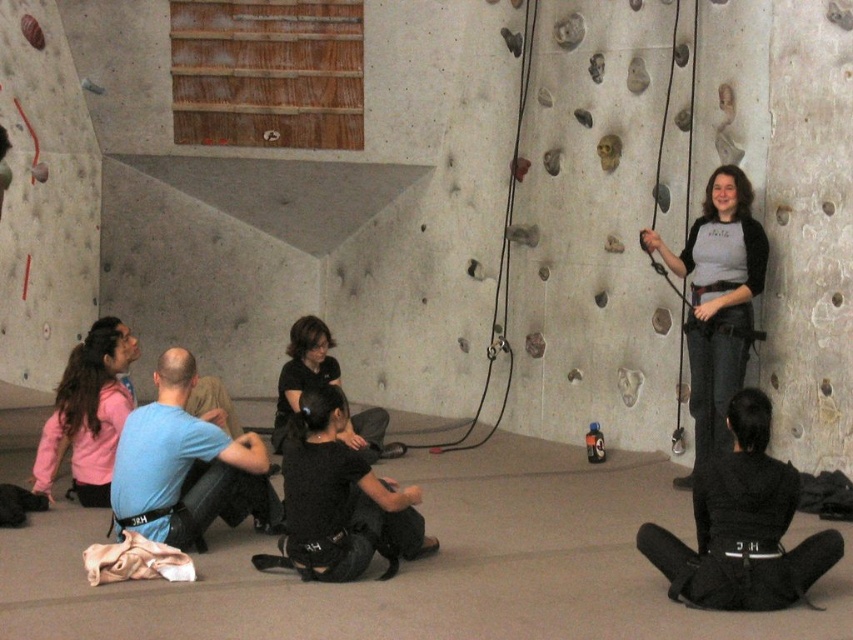
Looking at this image, you are a participant in the climbing lesson and need to retrieve both the black fabric squat at lower right and the black matte squat at center. Which one is closer to your current position if you are standing at the bottom of the climbing wall?

The black fabric squat at lower right is closer to your current position because it is located below the black matte squat at center, meaning it is nearer to the bottom of the climbing wall where you are standing.

You are a participant in the climbing lesson and need to retrieve your belongings stored near the black fabric squat at lower right. However, you are currently standing next to the black matte shirt at center. Which direction should you move to reach the squat?

A: Since the black fabric squat at lower right is closer to the viewer than the black matte shirt at center, you should move forward towards the black fabric squat at lower right to retrieve your belongings.

You are a photographer standing in the center of the room. You need to take a photo of the black fabric squat at lower right and the black matte shirt at center so that both are in the frame. Given that your camera has a maximum focal length that allows capturing objects within a 12 feet range, will you be able to include both in the same photo?

The black fabric squat at lower right and black matte shirt at center are 11.54 feet apart from each other. Since the distance between them is within the 12 feet range of your camera, you can capture both in the same photo.